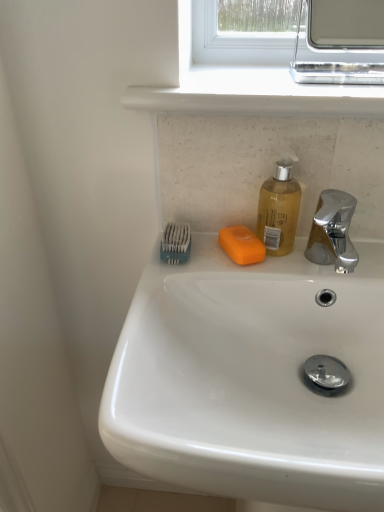
Find the location of a particular element. This screenshot has height=512, width=384. vacant area that lies to the right of blue plastic toothbrush at upper left is located at coordinates (276, 259).